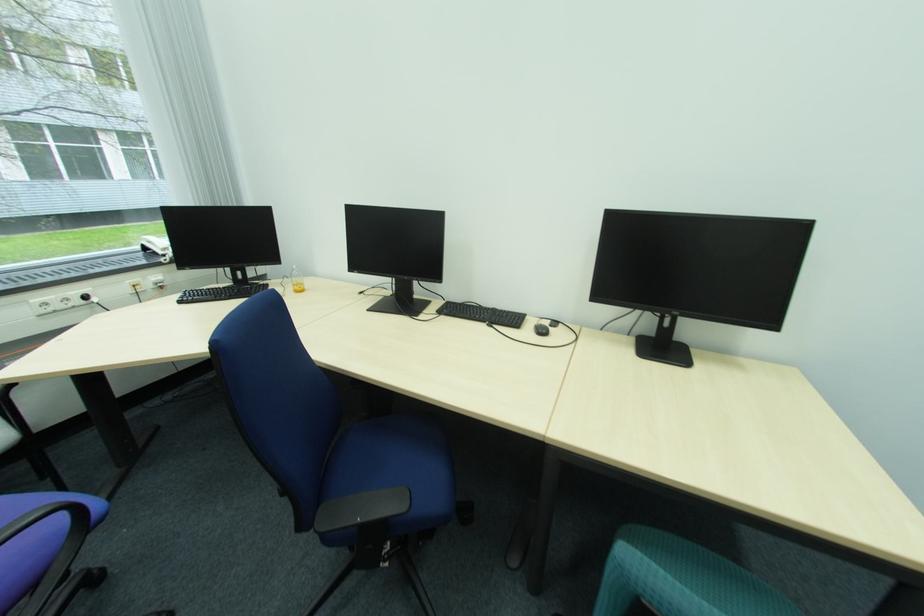
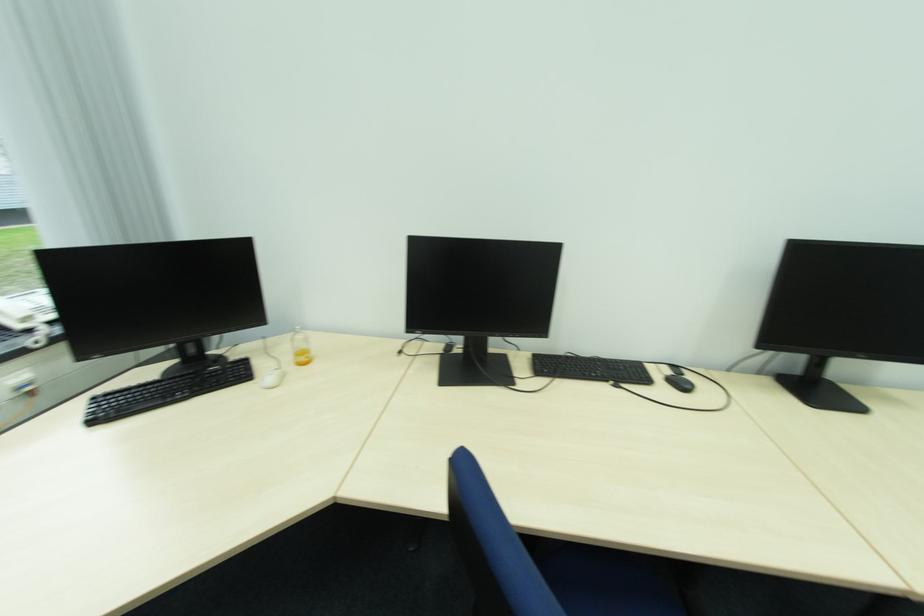
In a continuous first-person perspective shot, in which direction is the camera moving?

The cameraman walked toward left, forward.